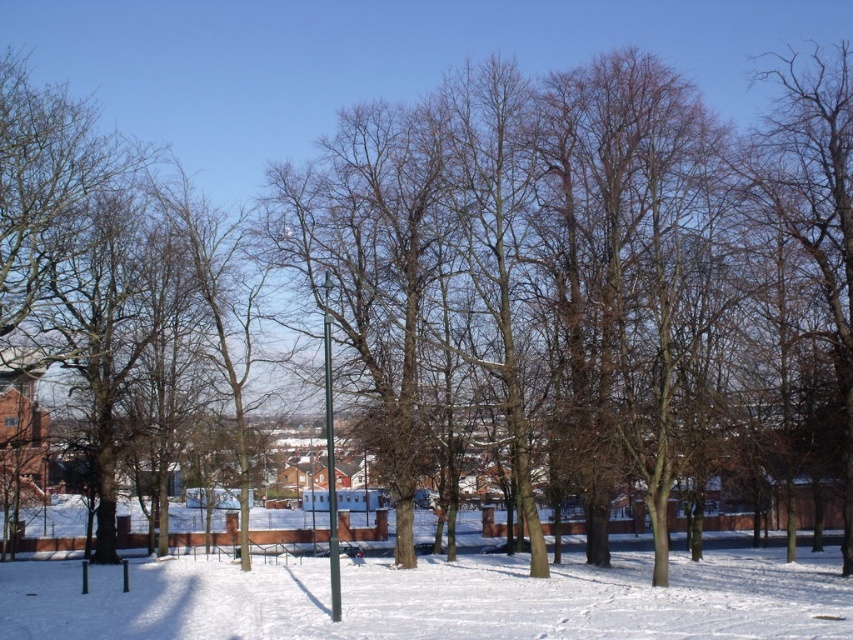
You are standing in the winter scene and want to place a small snowman exactly at the center of the white powdery snow at center. According to the coordinates provided, where should you place the snowman?

The snowman should be placed at the coordinates point [431,600] where the white powdery snow at center is located.

You are a photographer setting up a shot in the winter scene. You have a white powdery snow at center and a metallic pole at center in your frame. Which object in your frame is bigger?

The white powdery snow at center is larger than the metallic pole at center.

You are standing in the winter scene and want to walk towards the metallic pole at center. Which direction should you move relative to the white powdery snow at center?

The white powdery snow at center is in front of the metallic pole at center, so you should move away from the white powdery snow at center to reach the metallic pole at center.